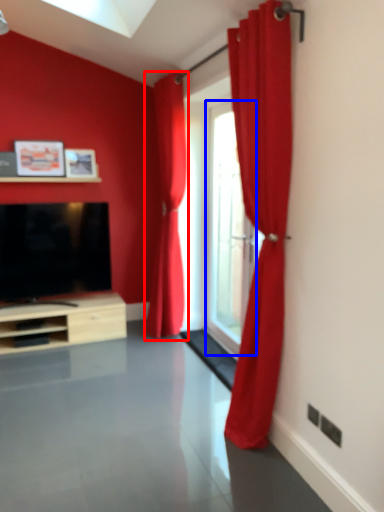
Question: Which object appears farthest to the camera in this image, curtain (highlighted by a red box) or window (highlighted by a blue box)?

Choices:
 (A) curtain
 (B) window

Answer: (A)